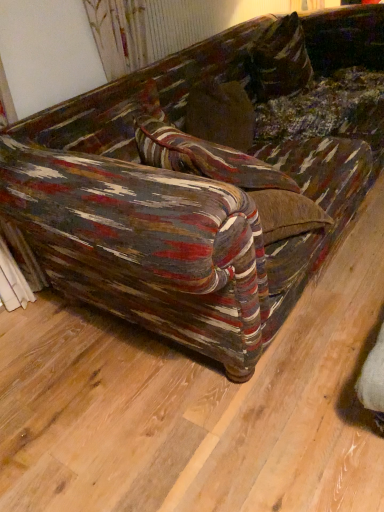
The width and height of the screenshot is (384, 512). What do you see at coordinates (201, 186) in the screenshot?
I see `multicolored fabric couch at center` at bounding box center [201, 186].

Where is `multicolored fabric couch at center`? multicolored fabric couch at center is located at coordinates (201, 186).

The height and width of the screenshot is (512, 384). What are the coordinates of `multicolored fabric couch at center` in the screenshot? It's located at (201, 186).